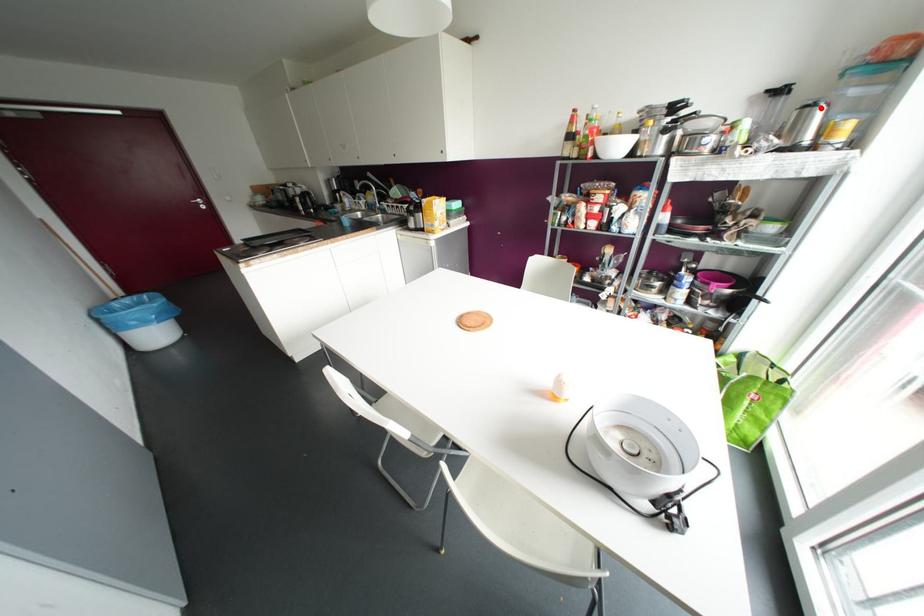
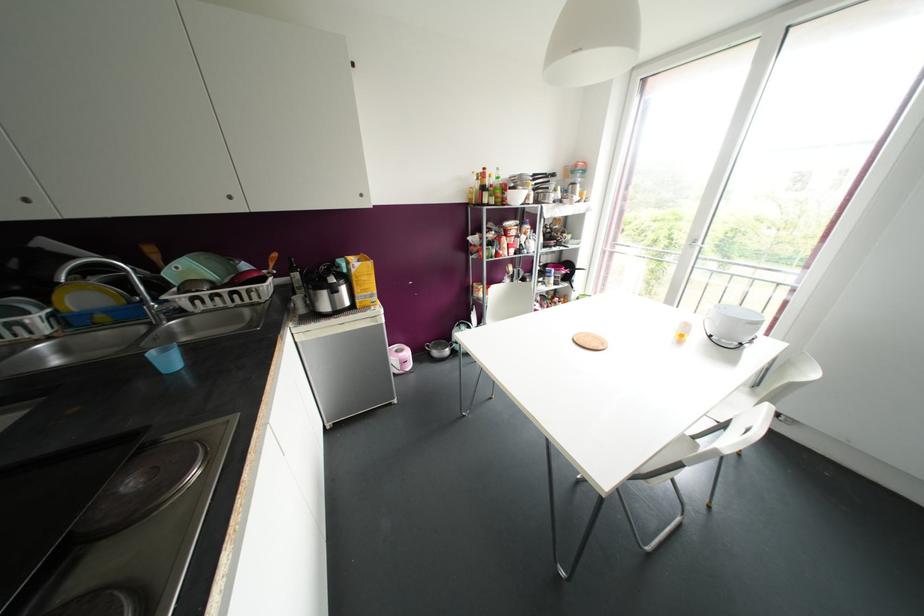
Locate, in the second image, the point that corresponds to the highlighted location in the first image.

(578, 185)